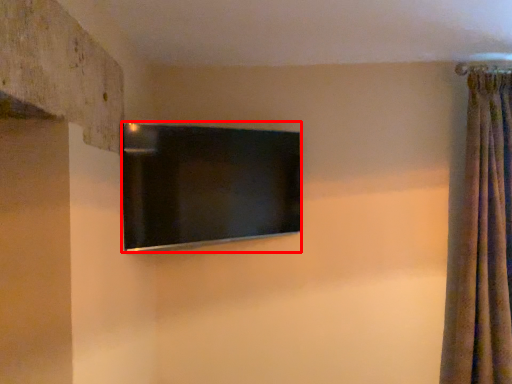
Question: From the image's perspective, what is the correct spatial positioning of television (annotated by the red box) in reference to curtain?

Choices:
 (A) above
 (B) below

Answer: (A)